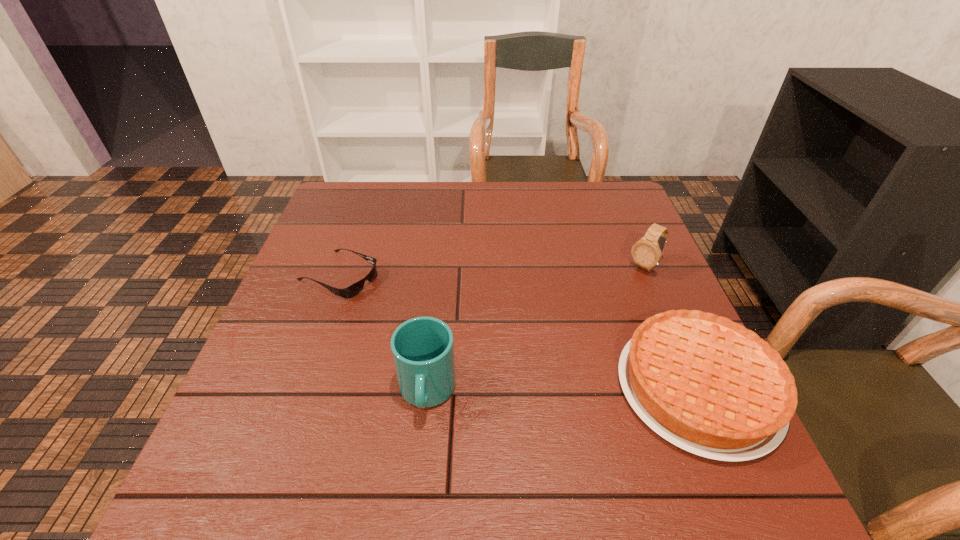
Where is `cup`? cup is located at coordinates pyautogui.click(x=422, y=348).

Identify the location of pie. The height and width of the screenshot is (540, 960). (706, 384).

The height and width of the screenshot is (540, 960). I want to click on watch, so click(646, 253).

Locate an element on the screen. The image size is (960, 540). the shortest object is located at coordinates (348, 292).

Locate an element on the screen. sunglasses is located at coordinates [348, 292].

Identify the location of vacant space located on the left of the pie. Image resolution: width=960 pixels, height=540 pixels. (530, 388).

You are a GUI agent. You are given a task and a screenshot of the screen. Output one action in this format:
    pyautogui.click(x=<x>, y=<y>)
    Task: Click on the free space located on the face of the watch
    
    Given the screenshot: What is the action you would take?
    pyautogui.click(x=604, y=309)

Where is `free space located on the face of the watch`? This screenshot has width=960, height=540. free space located on the face of the watch is located at coordinates (569, 345).

Where is `vacant area situated 0.230m on the face of the watch`? vacant area situated 0.230m on the face of the watch is located at coordinates (585, 329).

Where is `vacant space located 0.180m on the front-facing side of the leftmost object`? vacant space located 0.180m on the front-facing side of the leftmost object is located at coordinates (432, 315).